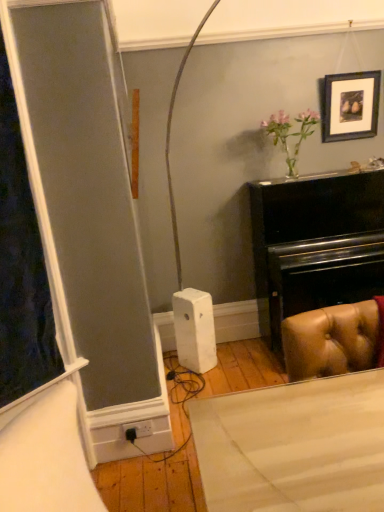
Question: Considering the relative sizes of black plastic plug at lower center and wooden picture frame at upper right in the image provided, is black plastic plug at lower center smaller than wooden picture frame at upper right?

Choices:
 (A) no
 (B) yes

Answer: (B)

Question: Is wooden picture frame at upper right at the back of black plastic plug at lower center?

Choices:
 (A) no
 (B) yes

Answer: (A)

Question: Does black plastic plug at lower center turn towards wooden picture frame at upper right?

Choices:
 (A) no
 (B) yes

Answer: (A)

Question: From a real-world perspective, does black plastic plug at lower center stand above wooden picture frame at upper right?

Choices:
 (A) yes
 (B) no

Answer: (B)

Question: Are black plastic plug at lower center and wooden picture frame at upper right far apart?

Choices:
 (A) no
 (B) yes

Answer: (B)

Question: Does black plastic plug at lower center have a lesser height compared to wooden picture frame at upper right?

Choices:
 (A) no
 (B) yes

Answer: (B)

Question: Does wooden picture frame at upper right turn towards black plastic plug at lower center?

Choices:
 (A) no
 (B) yes

Answer: (A)

Question: From a real-world perspective, is wooden picture frame at upper right located beneath black plastic plug at lower center?

Choices:
 (A) yes
 (B) no

Answer: (B)

Question: Is wooden picture frame at upper right oriented away from black plastic plug at lower center?

Choices:
 (A) no
 (B) yes

Answer: (A)

Question: Does wooden picture frame at upper right come behind black plastic plug at lower center?

Choices:
 (A) yes
 (B) no

Answer: (A)

Question: From the image's perspective, is wooden picture frame at upper right on top of black plastic plug at lower center?

Choices:
 (A) no
 (B) yes

Answer: (B)

Question: Is wooden picture frame at upper right to the left of black plastic plug at lower center from the viewer's perspective?

Choices:
 (A) no
 (B) yes

Answer: (A)

Question: From a real-world perspective, is wooden picture frame at upper right physically located above or below black plastic plug at lower center?

Choices:
 (A) below
 (B) above

Answer: (B)